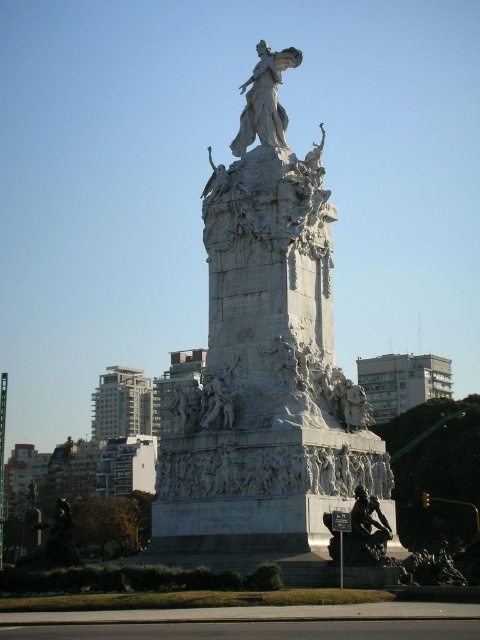
Question: Is white marble monument at center closer to the viewer compared to white marble statue at center?

Choices:
 (A) yes
 (B) no

Answer: (A)

Question: Which of the following is the closest to the observer?

Choices:
 (A) white marble statue at center
 (B) white marble monument at center

Answer: (B)

Question: Is white marble monument at center wider than white marble statue at center?

Choices:
 (A) yes
 (B) no

Answer: (A)

Question: Is white marble monument at center bigger than white marble statue at center?

Choices:
 (A) yes
 (B) no

Answer: (A)